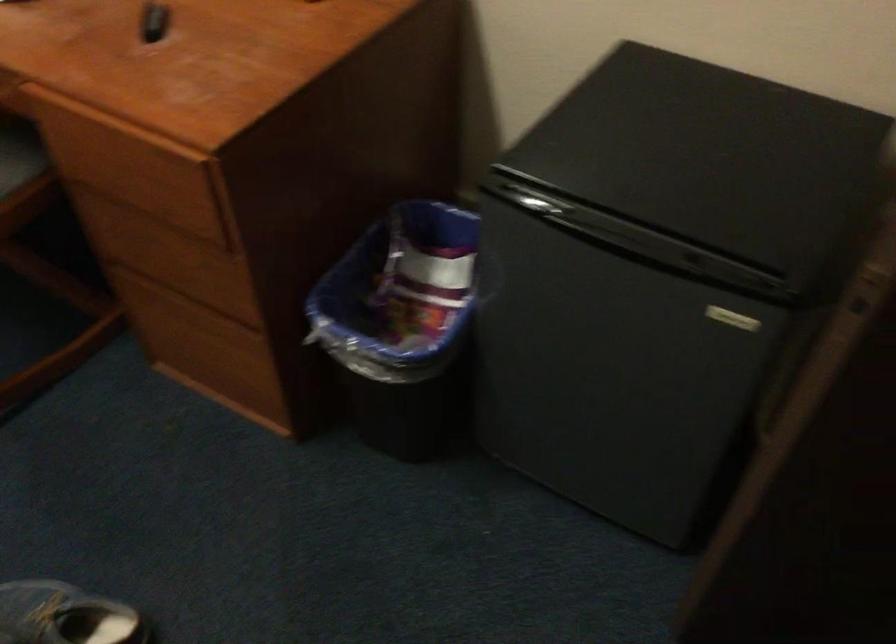
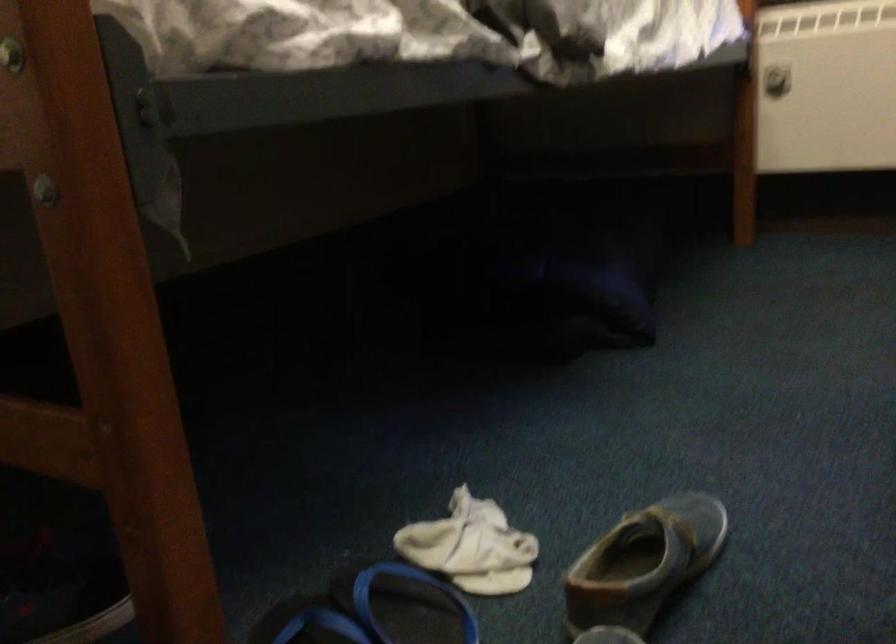
Question: The camera is either moving clockwise (left) or counter-clockwise (right) around the object. The first image is from the beginning of the video and the second image is from the end. Is the camera moving left or right when shooting the video?

Choices:
 (A) Left
 (B) Right

Answer: (B)